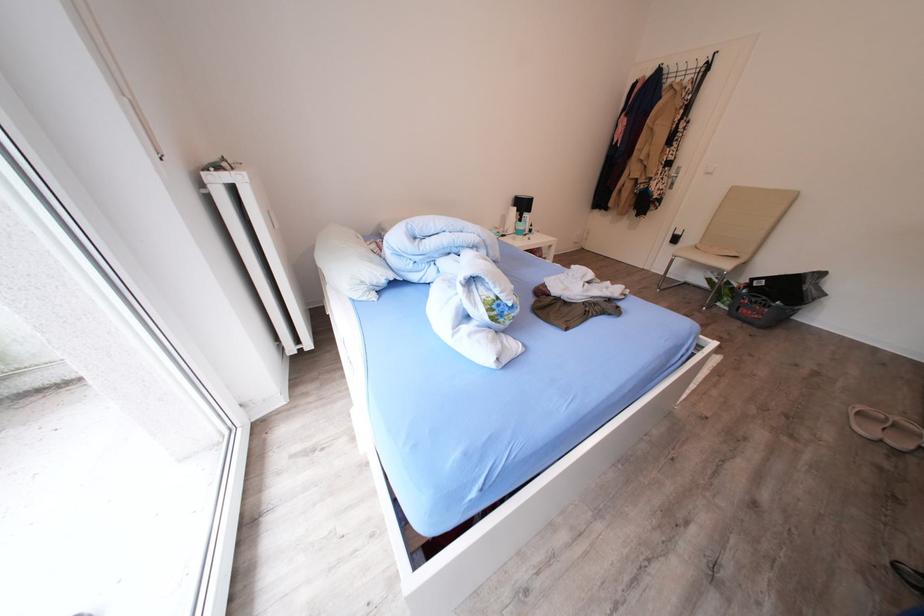
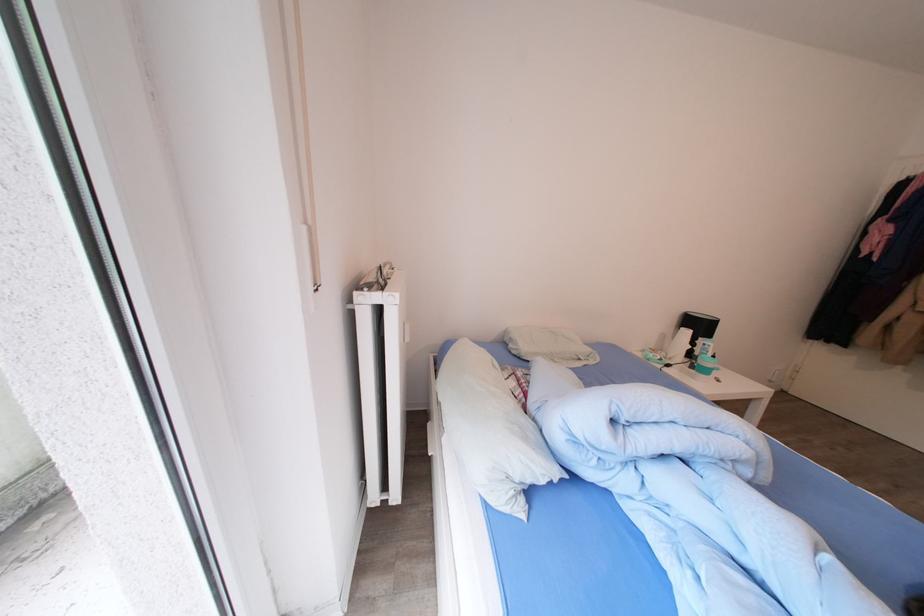
The images are taken continuously from a first-person perspective. In which direction are you moving?

The movement direction of the cameraman is left, forward.